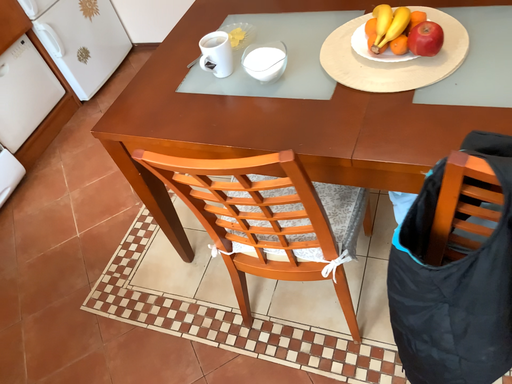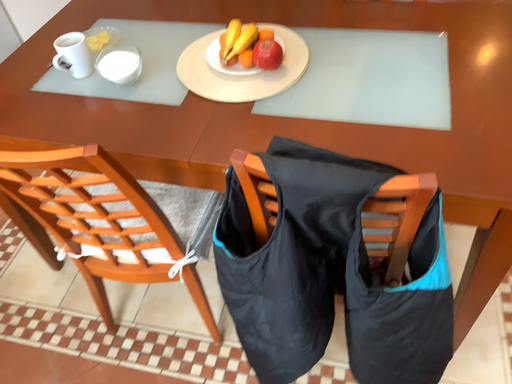
Question: Which way did the camera rotate in the video?

Choices:
 (A) rotated left
 (B) rotated right

Answer: (B)